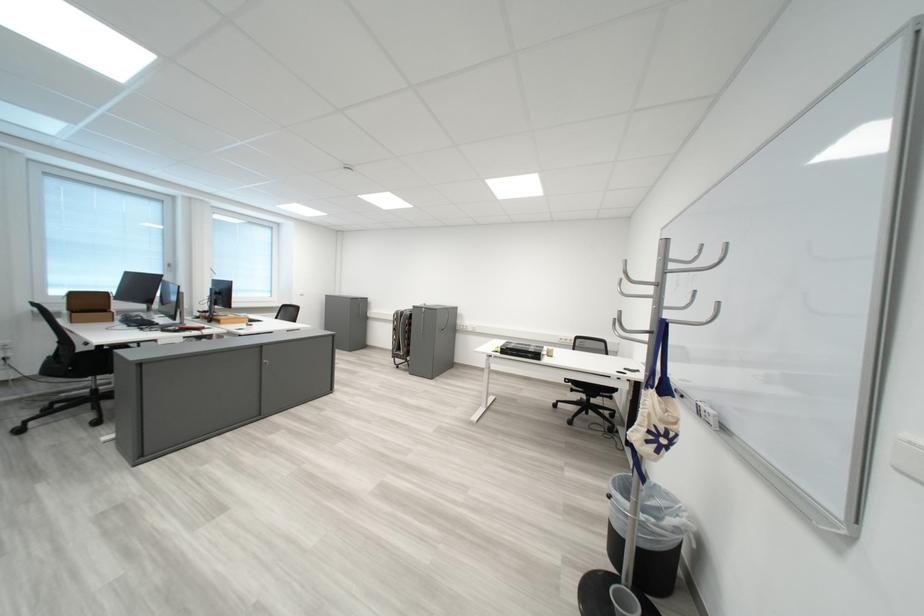
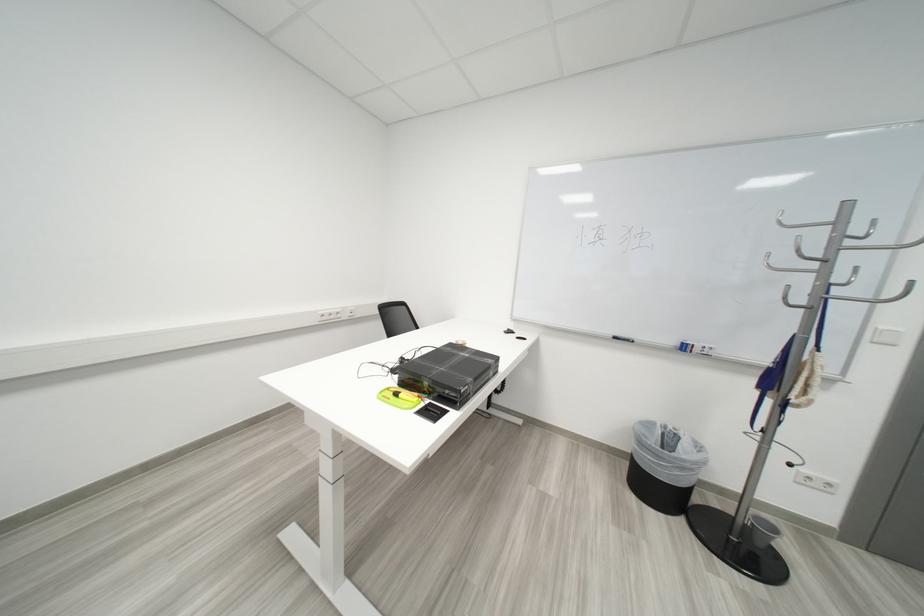
Locate, in the second image, the point that corresponds to (x=691, y=505) in the first image.

(666, 424)